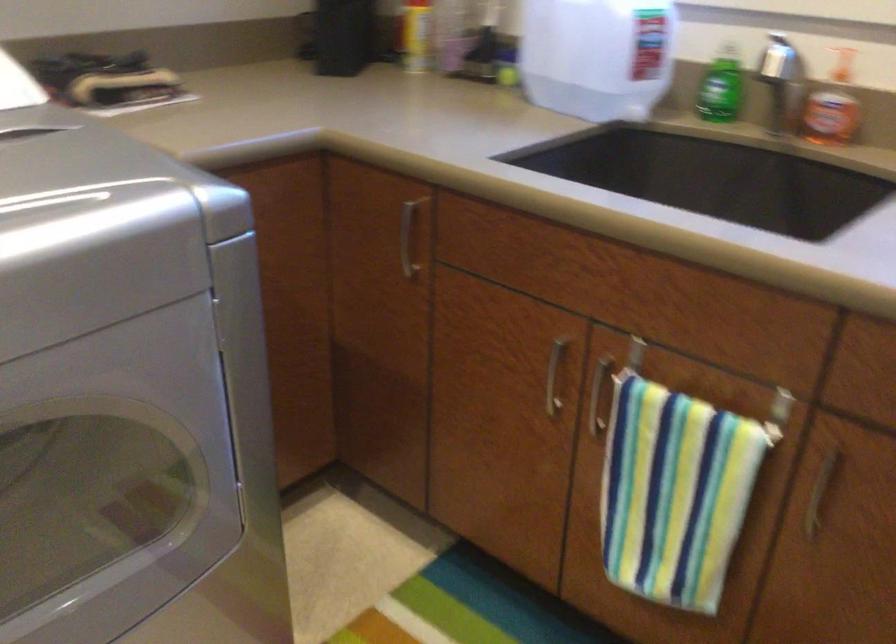
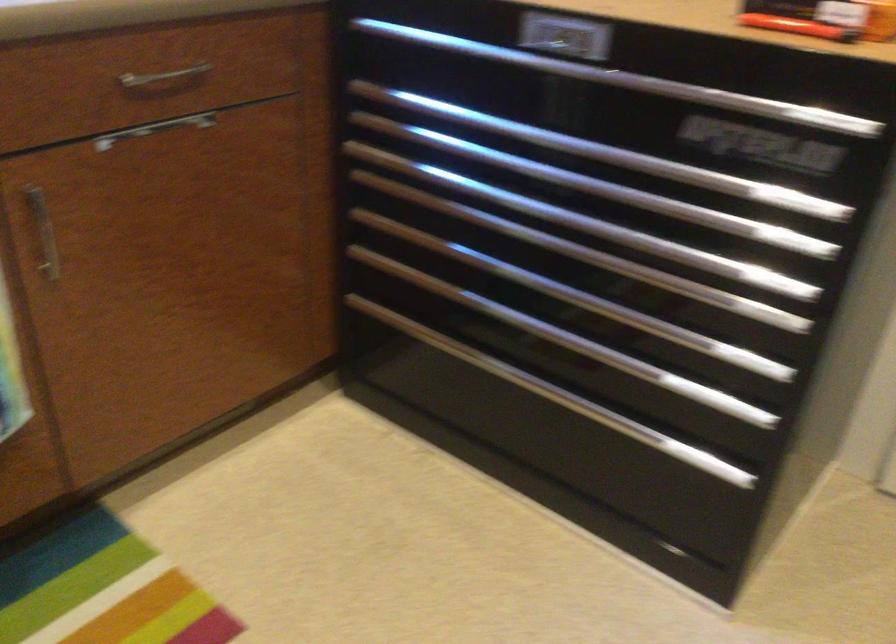
Based on the continuous images, in which direction is the camera rotating?

The camera's rotation is toward right-down.